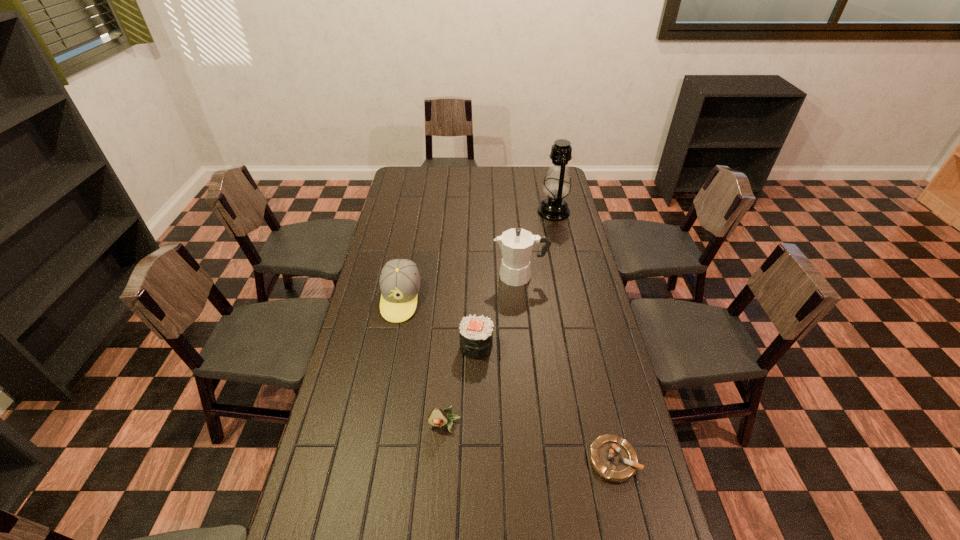
At what (x,y) coordinates should I click in order to perform the action: click on unoccupied area between the shortest object and the third object from right to left. Please return your answer as a coordinate pair (x, y). The height and width of the screenshot is (540, 960). Looking at the image, I should click on (566, 368).

The width and height of the screenshot is (960, 540). What are the coordinates of `free space between the tallest object and the third tallest object` in the screenshot? It's located at (477, 255).

The image size is (960, 540). I want to click on free space between the fourth farthest object and the avocado, so click(x=461, y=386).

Locate an element on the screen. vacant space that is in between the fourth farthest object and the leftmost object is located at coordinates (439, 322).

Identify which object is located as the nearest to the nearest object. Please provide its 2D coordinates. Your answer should be formatted as a tuple, i.e. [(x, y)], where the tuple contains the x and y coordinates of a point satisfying the conditions above.

[(437, 417)]

Locate an element on the screen. The width and height of the screenshot is (960, 540). object that stands as the third closest to the ashtray is located at coordinates (516, 244).

Find the location of a particular element. This screenshot has height=540, width=960. free location that satisfies the following two spatial constraints: 1. at the spout of the fourth object from left to right; 2. on the seed side of the second nearest object is located at coordinates (535, 425).

Where is `vacant space that satisfies the following two spatial constraints: 1. at the spout of the coffeepot; 2. on the front side of the fourth farthest object`? The image size is (960, 540). vacant space that satisfies the following two spatial constraints: 1. at the spout of the coffeepot; 2. on the front side of the fourth farthest object is located at coordinates (527, 346).

Locate an element on the screen. Image resolution: width=960 pixels, height=540 pixels. free space that satisfies the following two spatial constraints: 1. on the seed side of the ashtray; 2. on the right side of the avocado is located at coordinates (443, 460).

I want to click on free space in the image that satisfies the following two spatial constraints: 1. on the front side of the sushi; 2. on the right side of the shortest object, so click(476, 460).